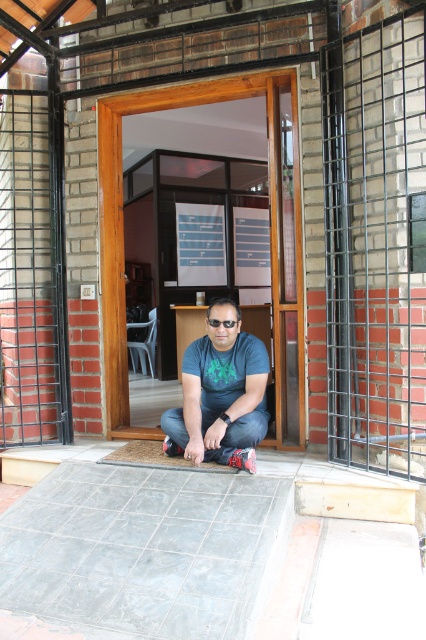
You are a photographer setting up a shoot in the doorway. You need to place a small tripod between the matte blue shirt at center and the black plastic goggles at center. Based on their positions, where should you position the tripod?

The matte blue shirt at center is located below the black plastic goggles at center, so the tripod should be placed between them, below the black plastic goggles at center and above the matte blue shirt at center.

You are a delivery person trying to enter the room through the doorway. The doorway is partially blocked by the black metal grid at right. Can you walk through the doorway without touching the grid?

The black metal grid at right is 8.82 feet away from the camera, so there is enough space to walk through the doorway without touching the grid.